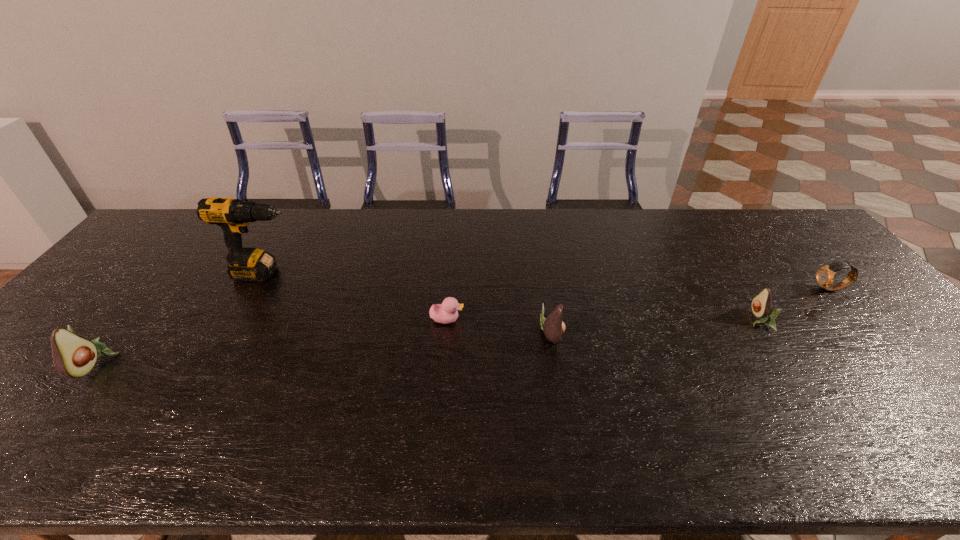
At what (x,y) coordinates should I click in order to perform the action: click on object that is the third closest one to the shortest avocado. Please return your answer as a coordinate pair (x, y). Looking at the image, I should click on (445, 313).

Locate which avocado is the third closest to the watch. Please provide its 2D coordinates. Your answer should be formatted as a tuple, i.e. [(x, y)], where the tuple contains the x and y coordinates of a point satisfying the conditions above.

[(73, 356)]

Find the location of a particular element. Image resolution: width=960 pixels, height=540 pixels. avocado identified as the third closest to the fifth object from right to left is located at coordinates (761, 305).